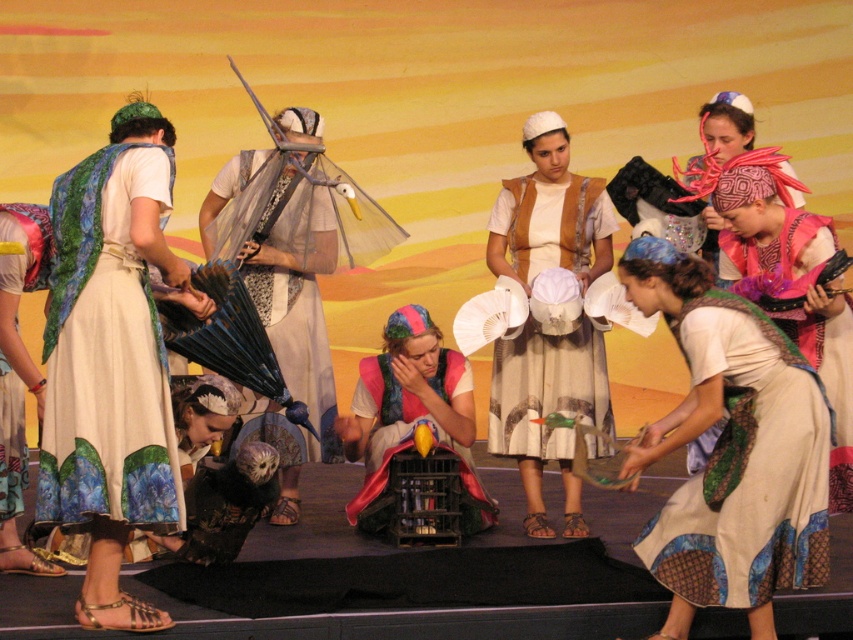
Question: Among these points, which one is farthest from the camera?

Choices:
 (A) (773, 230)
 (B) (273, 246)
 (C) (10, 392)
 (D) (358, 416)

Answer: (B)

Question: Does textured green scarf at left lie behind textured fabric skirt at left?

Choices:
 (A) yes
 (B) no

Answer: (B)

Question: Which point appears closest to the camera in this image?

Choices:
 (A) (412, 420)
 (B) (747, 448)
 (C) (50, 490)

Answer: (B)

Question: Is multicolored fabric headscarf at center positioned at the back of silky white robe at center?

Choices:
 (A) no
 (B) yes

Answer: (A)

Question: Estimate the real-world distances between objects in this image. Which object is farther from the silky white robe at center?

Choices:
 (A) white cotton dress at center
 (B) textured fabric skirt at left
 (C) multicolored fabric headscarf at center

Answer: (C)

Question: Is textured green scarf at left thinner than matte fabric bird at center?

Choices:
 (A) yes
 (B) no

Answer: (A)